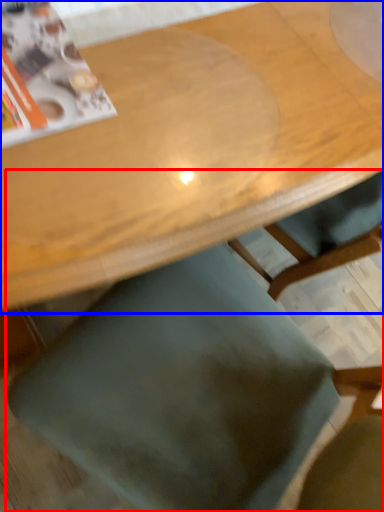
Question: Among these objects, which one is farthest to the camera, chair (highlighted by a red box) or table (highlighted by a blue box)?

Choices:
 (A) chair
 (B) table

Answer: (B)